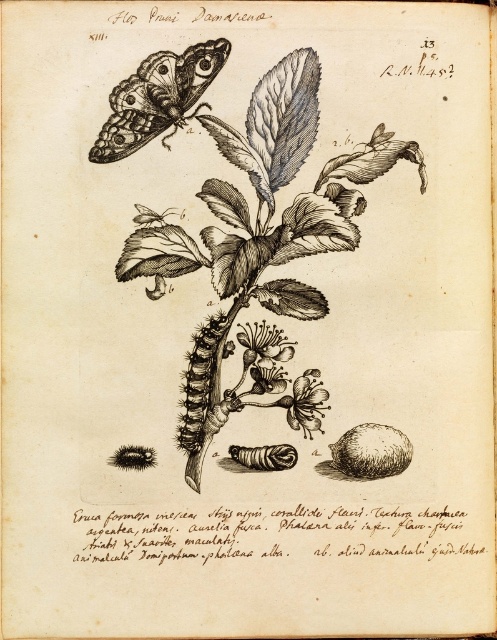
Which is in front, point (122, 148) or point (319, 397)?

Point (122, 148)

Is shiny black butterfly at upper left closer to camera compared to smooth white flower at center?

Yes, shiny black butterfly at upper left is closer to the viewer.

Find the location of a particular element. shiny black butterfly at upper left is located at coordinates coord(158,97).

Is point (352, 177) closer to camera compared to point (103, 145)?

No.

Does smooth brown stem at center have a greater height compared to shiny black butterfly at upper left?

Yes, smooth brown stem at center is taller than shiny black butterfly at upper left.

Which is in front, point (133, 145) or point (177, 90)?

Positioned in front is point (177, 90).

The width and height of the screenshot is (497, 640). I want to click on smooth brown stem at center, so click(246, 227).

Which is behind, point (129, 120) or point (221, 323)?

Positioned behind is point (221, 323).

Can you confirm if shiny black butterfly at upper left is positioned to the left of dark brown fuzzy caterpillar at center?

Correct, you'll find shiny black butterfly at upper left to the left of dark brown fuzzy caterpillar at center.

This screenshot has height=640, width=497. Describe the element at coordinates (158, 97) in the screenshot. I see `shiny black butterfly at upper left` at that location.

Locate an element on the screen. The image size is (497, 640). shiny black butterfly at upper left is located at coordinates (158, 97).